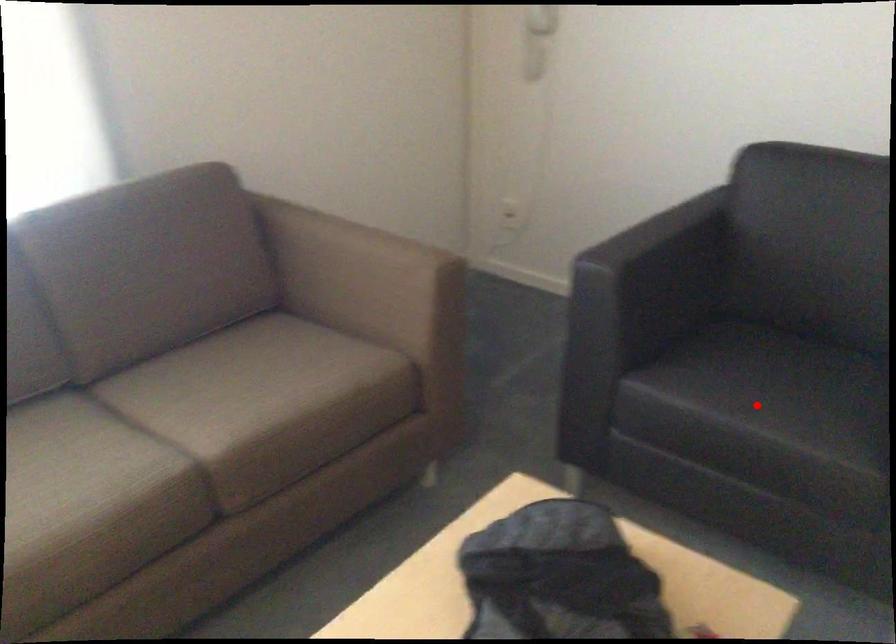
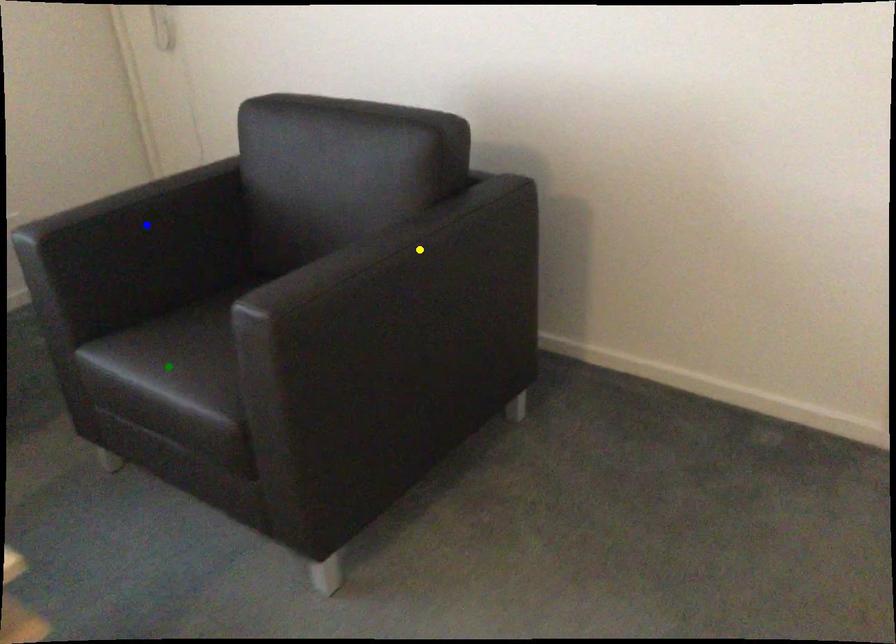
Question: I am providing you with two images of the same scene from different viewpoints. A red point is marked on the first image. You are given multiple points on the second image. Which point in image 2 is actually the same real-world point as the red point in image 1?

Choices:
 (A) green point
 (B) blue point
 (C) yellow point

Answer: (A)